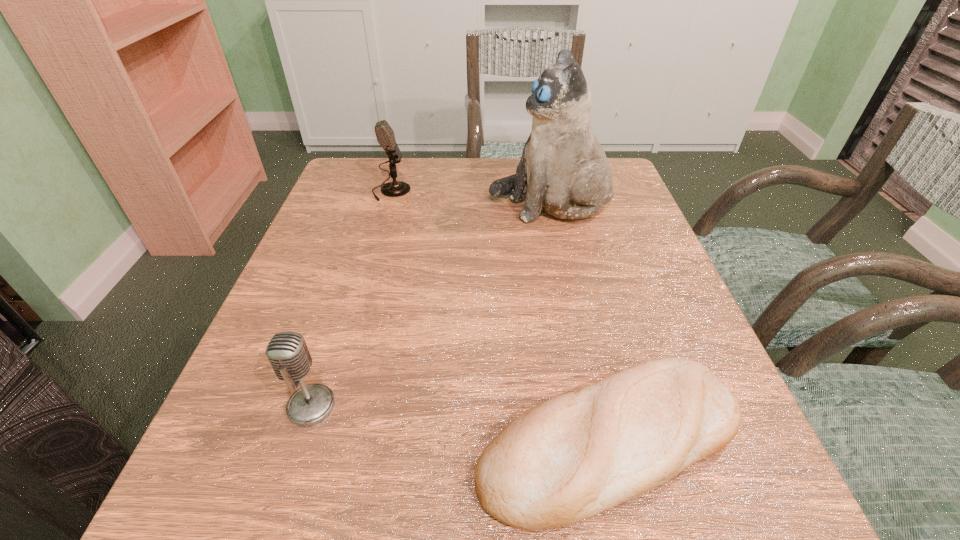
You are a GUI agent. You are given a task and a screenshot of the screen. Output one action in this format:
    pyautogui.click(x=<x>, y=<y>)
    Task: Click on the free space at the near edge
    The height and width of the screenshot is (540, 960).
    Given the screenshot: What is the action you would take?
    pyautogui.click(x=621, y=534)

In the image, there is a desktop. Where is `vacant space at the left edge`? The width and height of the screenshot is (960, 540). vacant space at the left edge is located at coordinates (293, 265).

Locate an element on the screen. blank space at the right edge of the desktop is located at coordinates (615, 347).

This screenshot has width=960, height=540. I want to click on free space at the far left corner of the desktop, so click(348, 170).

You are a GUI agent. You are given a task and a screenshot of the screen. Output one action in this format:
    pyautogui.click(x=<x>, y=<y>)
    Task: Click on the free space at the near left corner
    
    Given the screenshot: What is the action you would take?
    pyautogui.click(x=180, y=517)

Image resolution: width=960 pixels, height=540 pixels. I want to click on vacant space at the far right corner of the desktop, so click(x=627, y=198).

The image size is (960, 540). What are the coordinates of `vacant space at the near right corner` in the screenshot? It's located at (730, 472).

You are a GUI agent. You are given a task and a screenshot of the screen. Output one action in this format:
    pyautogui.click(x=<x>, y=<y>)
    Task: Click on the unoccupied position between the nearer microphone and the shortest object
    The image size is (960, 540).
    Given the screenshot: What is the action you would take?
    pyautogui.click(x=461, y=423)

Identify the location of free space between the shorter microphone and the tallest object. (430, 305).

Find the location of `vacant area that lies between the tallest object and the shorter microphone`. vacant area that lies between the tallest object and the shorter microphone is located at coordinates (430, 305).